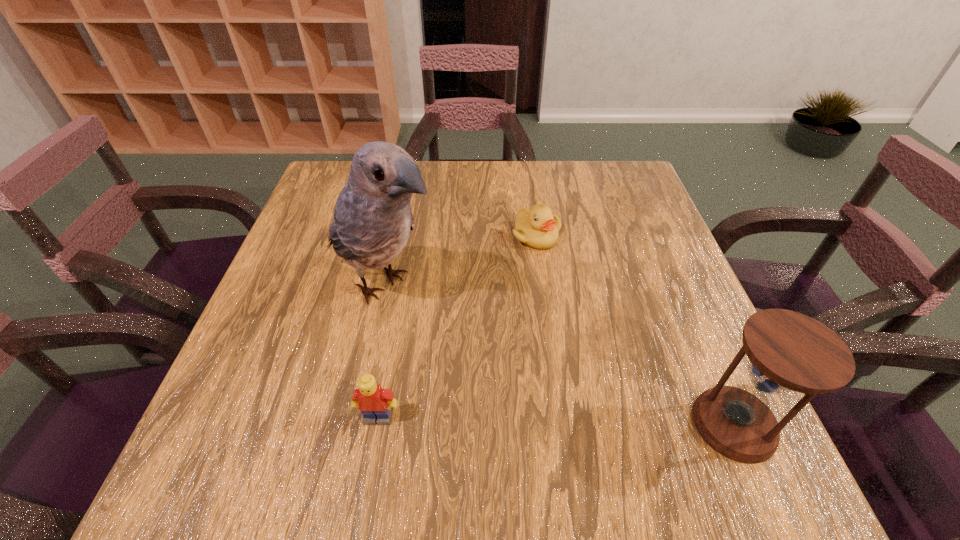
The height and width of the screenshot is (540, 960). I want to click on vacant space in between the third shortest object and the Lego, so click(x=556, y=421).

Identify the location of free area in between the second farthest object and the third tallest object. (381, 351).

Locate an element on the screen. vacant space in between the third shortest object and the duckling is located at coordinates (635, 330).

Where is `vacant space that is in between the tallest object and the second object from right to left`? This screenshot has width=960, height=540. vacant space that is in between the tallest object and the second object from right to left is located at coordinates (460, 260).

You are a GUI agent. You are given a task and a screenshot of the screen. Output one action in this format:
    pyautogui.click(x=<x>, y=<y>)
    Task: Click on the object that stands as the closest to the parrot
    The image size is (960, 540).
    Given the screenshot: What is the action you would take?
    pyautogui.click(x=538, y=228)

What are the coordinates of `object that is the third closest to the duckling` in the screenshot? It's located at (374, 402).